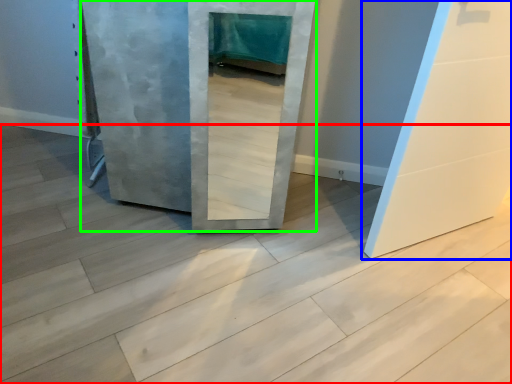
Question: Estimate the real-world distances between objects in this image. Which object is closer to concrete (highlighted by a red box), door (highlighted by a blue box) or door (highlighted by a green box)?

Choices:
 (A) door
 (B) door

Answer: (B)